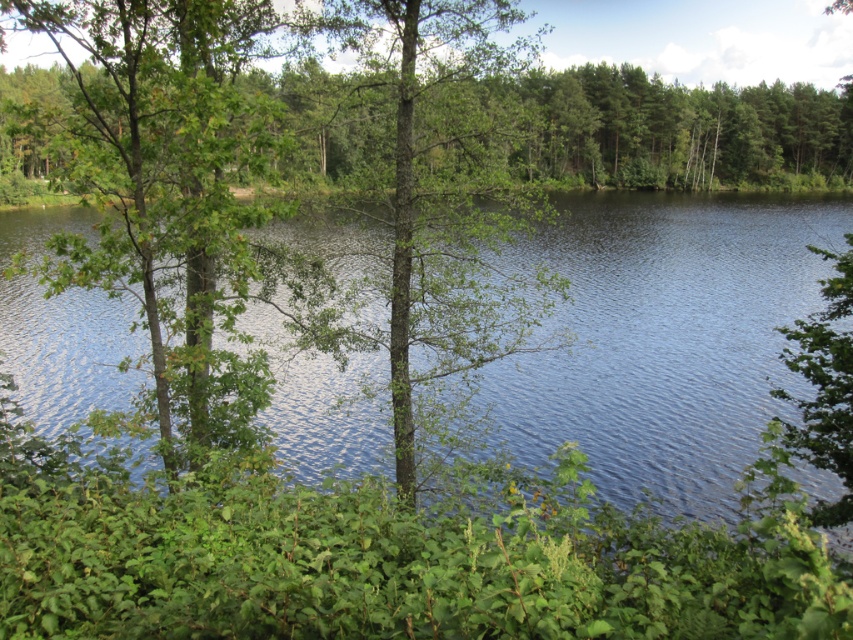
You are a bird flying over the serene natural landscape. You see the blue water at center and the green rough bark tree at center. Which object is higher in elevation?

The blue water at center is taller than the green rough bark tree at center, so the blue water at center is higher in elevation.

You are a photographer planning to capture the blue water at center and the green leafy tree at left in a single shot. Based on the scene, which object appears closer to the camera?

The green leafy tree at left appears closer to the camera because it has a greater height than the blue water at center, which is lower in the scene.